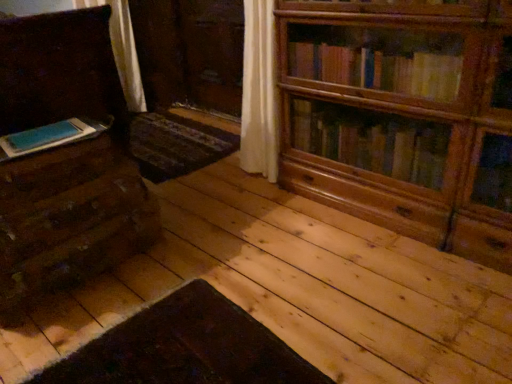
What are the coordinates of `blue matte book at left` in the screenshot? It's located at (48, 137).

What do you see at coordinates (53, 171) in the screenshot?
I see `matte wood drawer at left` at bounding box center [53, 171].

Identify the location of matte brown chest of drawers at left. This screenshot has width=512, height=384. (65, 162).

Does matte wood drawer at left turn towards matte brown chest of drawers at left?

No.

Considering the sizes of objects matte wood drawer at left and matte brown chest of drawers at left in the image provided, who is shorter, matte wood drawer at left or matte brown chest of drawers at left?

matte wood drawer at left is shorter.

Measure the distance from matte wood drawer at left to matte brown chest of drawers at left.

matte wood drawer at left is 7.19 inches from matte brown chest of drawers at left.

Based on the photo, from a real-world perspective, which is physically above, matte wood drawer at left or matte brown chest of drawers at left?

From a 3D spatial view, matte brown chest of drawers at left is above.

Does point (57, 130) come in front of point (69, 170)?

No.

Which of these two, blue matte book at left or matte wood drawer at left, is wider?

matte wood drawer at left.

In order to click on drawer in front of the blue matte book at left in this screenshot , I will do `click(53, 171)`.

From the image's perspective, is matte brown chest of drawers at left beneath blue matte book at left?

Actually, matte brown chest of drawers at left appears above blue matte book at left in the image.

Can you confirm if matte brown chest of drawers at left is bigger than blue matte book at left?

Correct, matte brown chest of drawers at left is larger in size than blue matte book at left.

Is matte brown chest of drawers at left beside blue matte book at left?

No, matte brown chest of drawers at left is not next to blue matte book at left.

Is matte brown chest of drawers at left spatially inside wooden bookcase at upper right, or outside of it?

matte brown chest of drawers at left exists outside the volume of wooden bookcase at upper right.

Locate an element on the screen. The height and width of the screenshot is (384, 512). bookcase on the right side of matte brown chest of drawers at left is located at coordinates (402, 116).

Considering the sizes of objects matte brown chest of drawers at left and wooden bookcase at upper right in the image provided, who is bigger, matte brown chest of drawers at left or wooden bookcase at upper right?

matte brown chest of drawers at left is bigger.

From a real-world perspective, between blue matte book at left and matte brown chest of drawers at left, who is vertically lower?

matte brown chest of drawers at left, from a real-world perspective.

The height and width of the screenshot is (384, 512). I want to click on the chest of drawers lying in front of the blue matte book at left, so click(65, 162).

From the image's perspective, which one is positioned lower, wooden bookcase at upper right or matte brown chest of drawers at left?

wooden bookcase at upper right appears lower in the image.

Which is more distant, (309,105) or (13,42)?

The point (309,105) is more distant.

Does wooden bookcase at upper right lie behind matte brown chest of drawers at left?

No.

Is wooden bookcase at upper right turned away from matte brown chest of drawers at left?

That's not correct — wooden bookcase at upper right is not looking away from matte brown chest of drawers at left.

Is matte wood drawer at left situated inside wooden bookcase at upper right or outside?

matte wood drawer at left exists outside the volume of wooden bookcase at upper right.

Is matte wood drawer at left beside wooden bookcase at upper right?

matte wood drawer at left is not next to wooden bookcase at upper right, and they're not touching.

Where is `drawer behind the wooden bookcase at upper right`? This screenshot has width=512, height=384. drawer behind the wooden bookcase at upper right is located at coordinates (53, 171).

Which point is more forward, [8,200] or [481,152]?

The point [8,200] is closer to the camera.

The width and height of the screenshot is (512, 384). In order to click on drawer that appears in front of the matte brown chest of drawers at left in this screenshot , I will do point(53,171).

The image size is (512, 384). I want to click on book located behind the matte wood drawer at left, so click(48, 137).

Estimate the real-world distances between objects in this image. Which object is further from wooden bookcase at upper right, matte wood drawer at left or blue matte book at left?

Based on the image, blue matte book at left appears to be further to wooden bookcase at upper right.

Looking at the image, which one is located closer to blue matte book at left, matte wood drawer at left or wooden bookcase at upper right?

The object closer to blue matte book at left is matte wood drawer at left.

Looking at this image, from the image, which object appears to be nearer to matte wood drawer at left, matte brown chest of drawers at left or blue matte book at left?

blue matte book at left is closer to matte wood drawer at left.

Which object lies further to the anchor point wooden bookcase at upper right, blue matte book at left or matte wood drawer at left?

blue matte book at left is positioned further to the anchor wooden bookcase at upper right.

Estimate the real-world distances between objects in this image. Which object is closer to matte brown chest of drawers at left, blue matte book at left or wooden bookcase at upper right?

Based on the image, blue matte book at left appears to be nearer to matte brown chest of drawers at left.

Estimate the real-world distances between objects in this image. Which object is further from matte wood drawer at left, wooden bookcase at upper right or blue matte book at left?

wooden bookcase at upper right.

Based on their spatial positions, is matte brown chest of drawers at left or wooden bookcase at upper right further from matte wood drawer at left?

Among the two, wooden bookcase at upper right is located further to matte wood drawer at left.

Based on their spatial positions, is blue matte book at left or wooden bookcase at upper right further from matte wood drawer at left?

Based on the image, wooden bookcase at upper right appears to be further to matte wood drawer at left.

Identify the location of book between matte wood drawer at left and wooden bookcase at upper right. Image resolution: width=512 pixels, height=384 pixels. (48, 137).

Find the location of a particular element. This screenshot has height=384, width=512. book located between matte brown chest of drawers at left and wooden bookcase at upper right in the left-right direction is located at coordinates click(48, 137).

This screenshot has height=384, width=512. What are the coordinates of `drawer situated between matte brown chest of drawers at left and wooden bookcase at upper right from left to right` in the screenshot? It's located at (53, 171).

Identify the location of drawer between matte brown chest of drawers at left and blue matte book at left. The width and height of the screenshot is (512, 384). (53, 171).